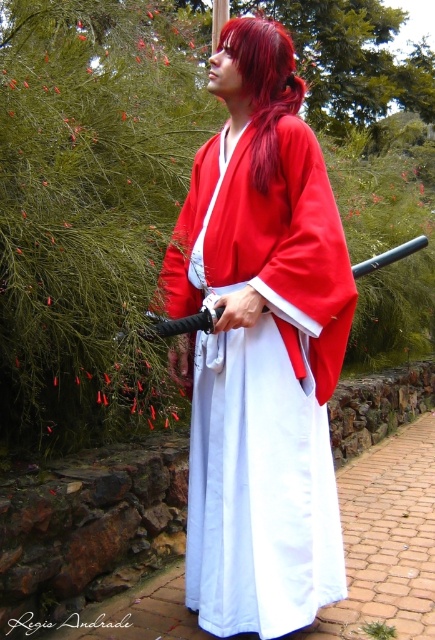
Does point (170, 257) come in front of point (274, 120)?

That is False.

Based on the photo, is matte red kimono at center to the left of shiny red hair at center from the viewer's perspective?

Correct, you'll find matte red kimono at center to the left of shiny red hair at center.

Measure the distance between matte red kimono at center and camera.

4.01 feet

At what (x,y) coordinates should I click in order to perform the action: click on matte red kimono at center. Please return your answer as a coordinate pair (x, y). The width and height of the screenshot is (435, 640). Looking at the image, I should click on (261, 348).